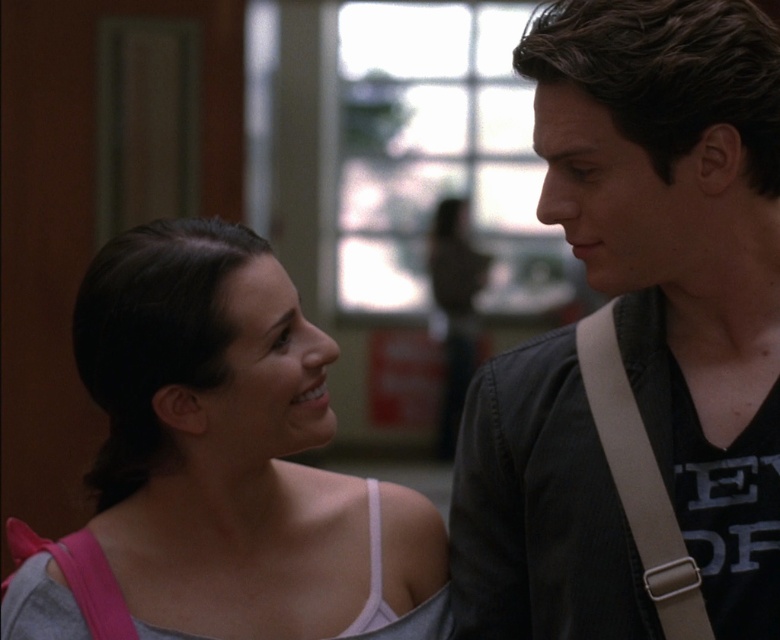
You are standing at the position of the point at coordinates point (651, 452). You want to walk to the point at coordinates point (399, 560). Is the point you want to reach in front of or behind you?

The point at coordinates point (399, 560) is behind point (651, 452), so the point you want to reach is behind you.

You are an observer in the scene. You notice the dark brown hair at upper right and the matte gray tank top at center. Which object is positioned higher in the image?

The dark brown hair at upper right is located above the matte gray tank top at center, so it is positioned higher in the image.

From the picture: You are standing in front of the two people in the image. Which of the two points, point (752,221) or point (254,300), is closer to you?

Point (752,221) is closer to the viewer than point (254,300).